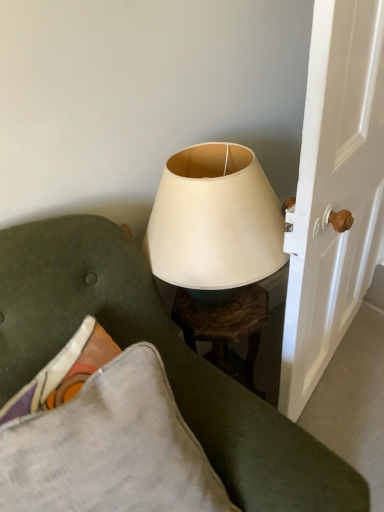
Measure the distance between point (x=134, y=370) and camera.

Point (x=134, y=370) is 70.10 centimeters from camera.

Describe the element at coordinates (163, 359) in the screenshot. I see `matte white lampshade at upper center` at that location.

Find the location of a particular element. matte white lampshade at upper center is located at coordinates (163, 359).

You are a GUI agent. You are given a task and a screenshot of the screen. Output one action in this format:
    pyautogui.click(x=<x>, y=<y>)
    Task: Click on the white glossy door handle at right
    The width and height of the screenshot is (384, 512).
    Given the screenshot: What is the action you would take?
    pyautogui.click(x=334, y=192)

Considering the sizes of objects matte white lampshade at upper center and matte white lampshade at center in the image provided, who is wider, matte white lampshade at upper center or matte white lampshade at center?

matte white lampshade at center.

From a real-world perspective, between matte white lampshade at upper center and matte white lampshade at center, who is vertically higher?

matte white lampshade at center.

Between matte white lampshade at upper center and matte white lampshade at center, which one has less height?

matte white lampshade at center is shorter.

Would you say matte white lampshade at upper center is outside textured gray pillow at lower left?

No, matte white lampshade at upper center is not outside of textured gray pillow at lower left.

From a real-world perspective, is matte white lampshade at upper center over textured gray pillow at lower left?

Yes, from a real-world perspective, matte white lampshade at upper center is on top of textured gray pillow at lower left.

Is matte white lampshade at upper center taller than textured gray pillow at lower left?

Yes.

From the image's perspective, is matte white lampshade at upper center under textured gray pillow at lower left?

Indeed, from the image's perspective, matte white lampshade at upper center is shown beneath textured gray pillow at lower left.

Is textured gray pillow at lower left not close to matte white lampshade at upper center?

They are positioned close to each other.

How distant is textured gray pillow at lower left from matte white lampshade at upper center?

The distance of textured gray pillow at lower left from matte white lampshade at upper center is 8.47 inches.

Is textured gray pillow at lower left not within matte white lampshade at upper center?

That's incorrect, textured gray pillow at lower left is not completely outside matte white lampshade at upper center.

From a real-world perspective, is textured gray pillow at lower left above or below white glossy door handle at right?

In terms of real-world spatial position, textured gray pillow at lower left is below white glossy door handle at right.

Does textured gray pillow at lower left lie behind white glossy door handle at right?

No, it is in front of white glossy door handle at right.

Is textured gray pillow at lower left looking in the opposite direction of white glossy door handle at right?

textured gray pillow at lower left is not turned away from white glossy door handle at right.

Based on the photo, can you tell me how much textured gray pillow at lower left and white glossy door handle at right differ in facing direction?

19.7 degrees.

Would you consider matte white lampshade at center to be distant from white glossy door handle at right?

No, matte white lampshade at center is not far from white glossy door handle at right.

Between matte white lampshade at center and white glossy door handle at right, which one has more height?

white glossy door handle at right.

Measure the distance from matte white lampshade at center to white glossy door handle at right.

9.07 inches.

Considering the sizes of objects matte white lampshade at center and white glossy door handle at right in the image provided, who is wider, matte white lampshade at center or white glossy door handle at right?

Wider between the two is matte white lampshade at center.

From a real-world perspective, who is located higher, white glossy door handle at right or matte white lampshade at center?

matte white lampshade at center.

Considering the points (311, 94) and (247, 268), which point is in front, point (311, 94) or point (247, 268)?

Point (311, 94)

Is white glossy door handle at right oriented towards matte white lampshade at center?

No, white glossy door handle at right is not turned towards matte white lampshade at center.

Measure the distance between matte white lampshade at center and matte white lampshade at upper center.

matte white lampshade at center is 9.58 inches away from matte white lampshade at upper center.

Considering the relative sizes of matte white lampshade at center and matte white lampshade at upper center in the image provided, is matte white lampshade at center shorter than matte white lampshade at upper center?

Indeed, matte white lampshade at center has a lesser height compared to matte white lampshade at upper center.

Does point (273, 225) lie behind point (295, 448)?

Yes, point (273, 225) is behind point (295, 448).

Where is `lamp above the matte white lampshade at upper center (from the image's perspective)`? lamp above the matte white lampshade at upper center (from the image's perspective) is located at coordinates (217, 247).

Locate an element on the screen. The width and height of the screenshot is (384, 512). furniture in front of the matte white lampshade at center is located at coordinates (163, 359).

You are a GUI agent. You are given a task and a screenshot of the screen. Output one action in this format:
    pyautogui.click(x=<x>, y=<y>)
    Task: Click on the pillow on the left of matte white lampshade at upper center
    The image size is (384, 512).
    Given the screenshot: What is the action you would take?
    pyautogui.click(x=110, y=448)

Considering their positions, is textured gray pillow at lower left positioned closer to matte white lampshade at upper center than matte white lampshade at center?

textured gray pillow at lower left.

When comparing their distances from matte white lampshade at center, does white glossy door handle at right or textured gray pillow at lower left seem further?

Among the two, textured gray pillow at lower left is located further to matte white lampshade at center.

Based on their spatial positions, is matte white lampshade at center or white glossy door handle at right further from matte white lampshade at upper center?

The object further to matte white lampshade at upper center is white glossy door handle at right.

Considering their positions, is white glossy door handle at right positioned further to matte white lampshade at upper center than matte white lampshade at center?

Among the two, white glossy door handle at right is located further to matte white lampshade at upper center.

Which object lies nearer to the anchor point textured gray pillow at lower left, matte white lampshade at center or matte white lampshade at upper center?

Based on the image, matte white lampshade at upper center appears to be nearer to textured gray pillow at lower left.

Considering their positions, is textured gray pillow at lower left positioned closer to matte white lampshade at center than white glossy door handle at right?

Among the two, white glossy door handle at right is located nearer to matte white lampshade at center.

Estimate the real-world distances between objects in this image. Which object is further from matte white lampshade at center, matte white lampshade at upper center or white glossy door handle at right?

Among the two, matte white lampshade at upper center is located further to matte white lampshade at center.

Looking at the image, which one is located further to matte white lampshade at center, matte white lampshade at upper center or textured gray pillow at lower left?

Among the two, textured gray pillow at lower left is located further to matte white lampshade at center.

Find the location of a particular element. The height and width of the screenshot is (512, 384). lamp situated between matte white lampshade at upper center and white glossy door handle at right from left to right is located at coordinates (217, 247).

Locate an element on the screen. pillow between matte white lampshade at center and matte white lampshade at upper center vertically is located at coordinates (110, 448).

At what (x,y) coordinates should I click in order to perform the action: click on furniture between textured gray pillow at lower left and white glossy door handle at right from left to right. Please return your answer as a coordinate pair (x, y). Looking at the image, I should click on (163, 359).

The image size is (384, 512). Identify the location of lamp between textured gray pillow at lower left and white glossy door handle at right in the horizontal direction. (217, 247).